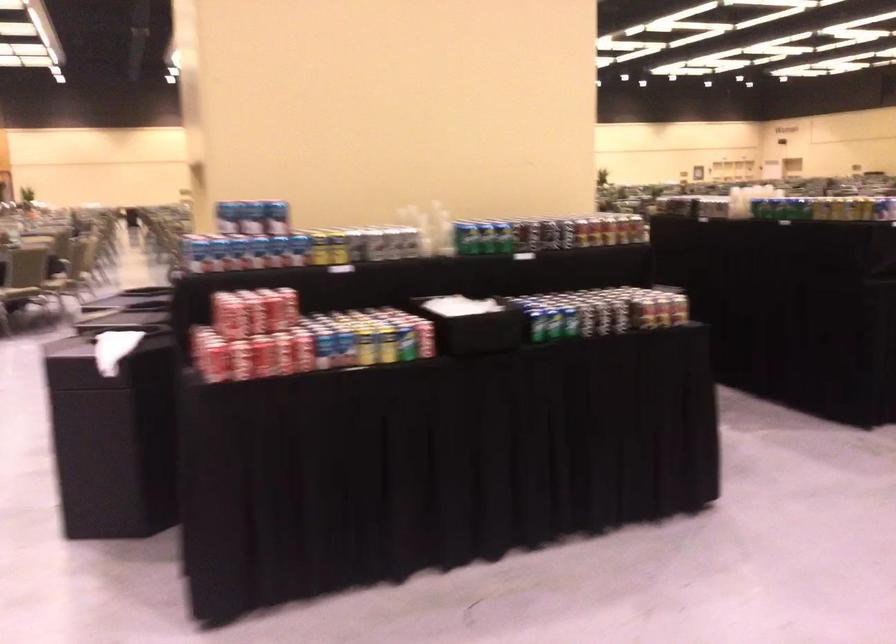
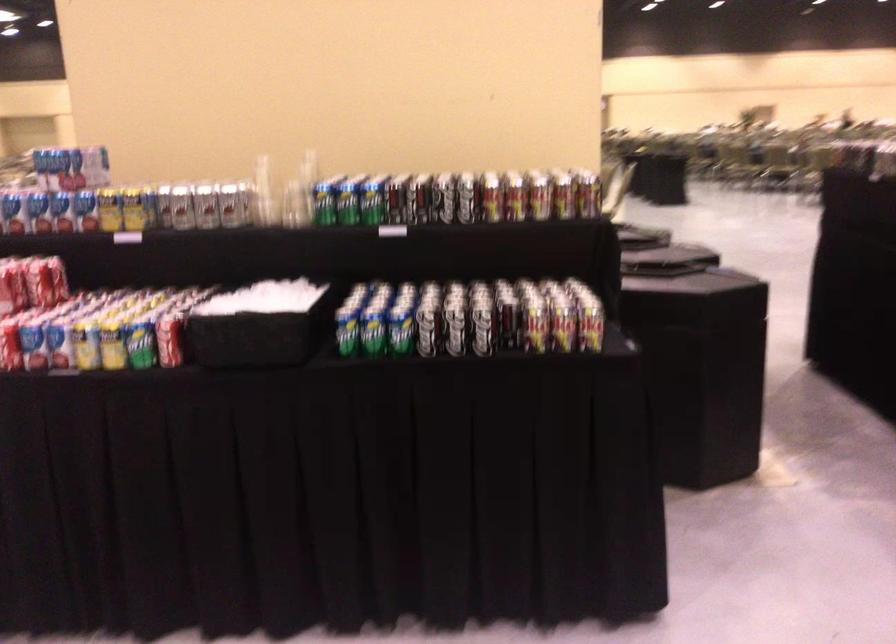
Find the pixel in the second image that matches the point at 418,339 in the first image.

(169, 339)